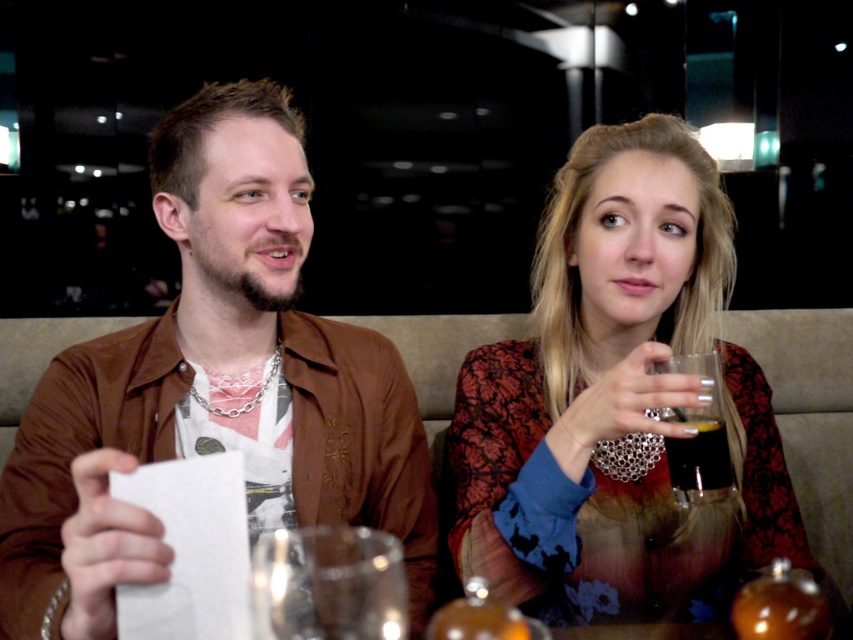
Is brown leather jacket at center closer to the viewer compared to translucent glass at upper right?

That is True.

Between brown leather jacket at center and translucent glass at upper right, which one is positioned higher?

Positioned higher is brown leather jacket at center.

Between point (93, 620) and point (665, 365), which one is positioned in front?

Point (93, 620) is in front.

Identify the location of brown leather jacket at center. This screenshot has height=640, width=853. (213, 387).

Can you confirm if brown leather jacket at center is taller than matte black dress at center?

Correct, brown leather jacket at center is much taller as matte black dress at center.

The image size is (853, 640). Describe the element at coordinates (213, 387) in the screenshot. I see `brown leather jacket at center` at that location.

Does point (97, 339) lie in front of point (521, 417)?

That is False.

Where is `brown leather jacket at center`? Image resolution: width=853 pixels, height=640 pixels. brown leather jacket at center is located at coordinates (213, 387).

Is transparent glass at lower center below translucent glass at upper right?

Yes, transparent glass at lower center is below translucent glass at upper right.

In the scene shown: Is transparent glass at lower center above translucent glass at upper right?

Incorrect, transparent glass at lower center is not positioned above translucent glass at upper right.

Between point (372, 586) and point (717, 486), which one is positioned in front?

Point (372, 586) is more forward.

The height and width of the screenshot is (640, 853). In order to click on transparent glass at lower center in this screenshot , I will do `click(328, 584)`.